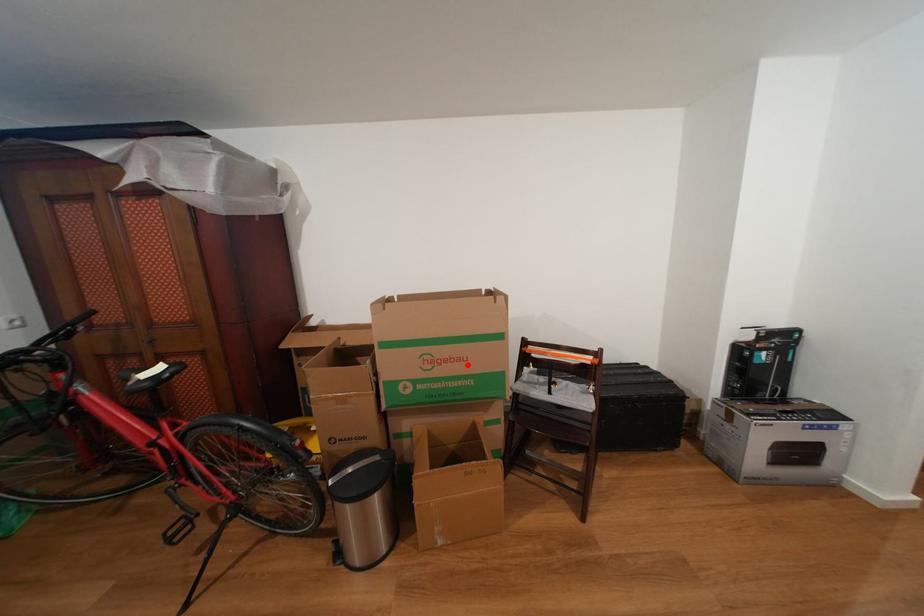
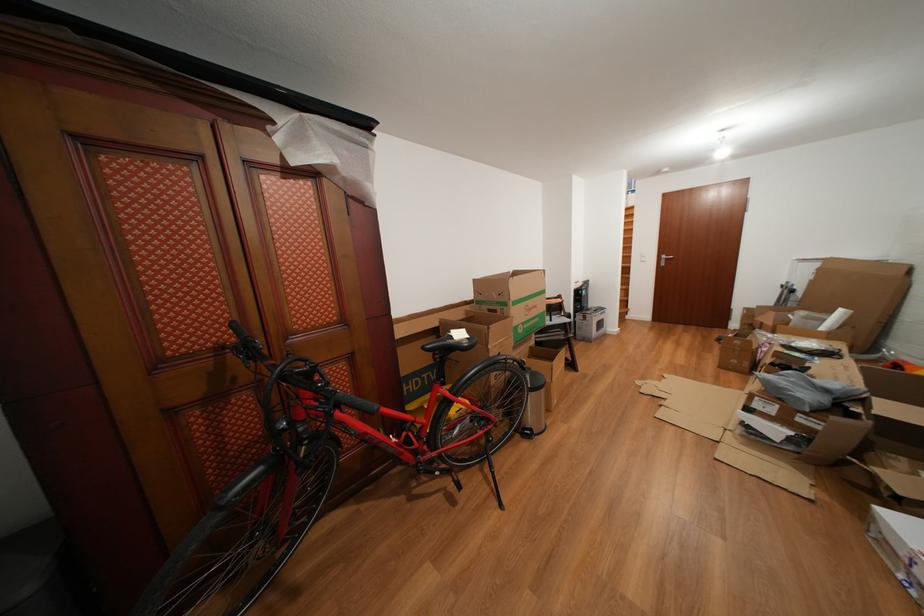
In the second image, find the point that corresponds to the highlighted location in the first image.

(543, 312)